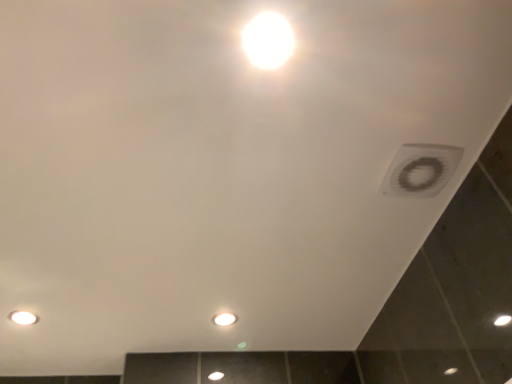
Question: Visually, is bright white glossy light bulb at upper center, positioned as the third light bulb in back-to-front order, positioned to the left or to the right of matte white light bulb at lower left, arranged as the 2th light bulb when ordered from the bottom?

Choices:
 (A) left
 (B) right

Answer: (B)

Question: Looking at the image, does bright white glossy light bulb at upper center, which is the 1th light bulb from right to left, seem bigger or smaller compared to matte white light bulb at lower left, which is counted as the 2th light bulb, starting from the top?

Choices:
 (A) small
 (B) big

Answer: (B)

Question: Which object is positioned closest to the white matte vent at upper right?

Choices:
 (A) white glossy light bulb at center, which ranks as the 3th light bulb in top-to-bottom order
 (B) bright white glossy light bulb at upper center, which is the 1th light bulb from right to left
 (C) matte white light bulb at lower left, arranged as the 2th light bulb when ordered from the bottom

Answer: (B)

Question: Which of these objects is positioned closest to the white glossy light bulb at center, which ranks as the 2th light bulb in left-to-right order?

Choices:
 (A) matte white light bulb at lower left, the 2th light bulb in the front-to-back sequence
 (B) white matte vent at upper right
 (C) bright white glossy light bulb at upper center, positioned as the 1th light bulb in front-to-back order

Answer: (A)